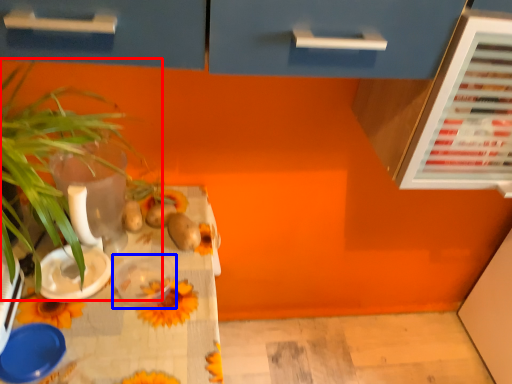
Question: Which object is further to the camera taking this photo, houseplant (highlighted by a red box) or tableware (highlighted by a blue box)?

Choices:
 (A) houseplant
 (B) tableware

Answer: (B)